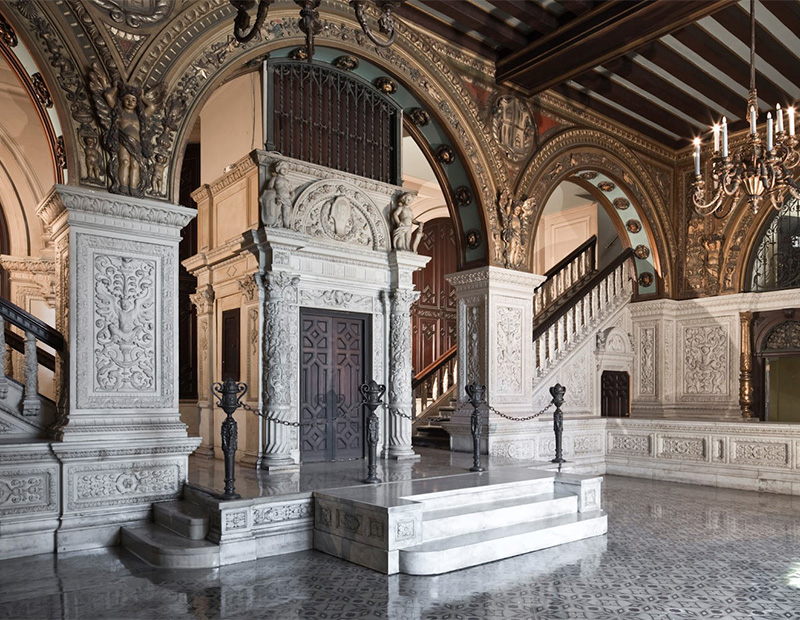
Where is `tiled floor`? The height and width of the screenshot is (620, 800). tiled floor is located at coordinates (700, 562).